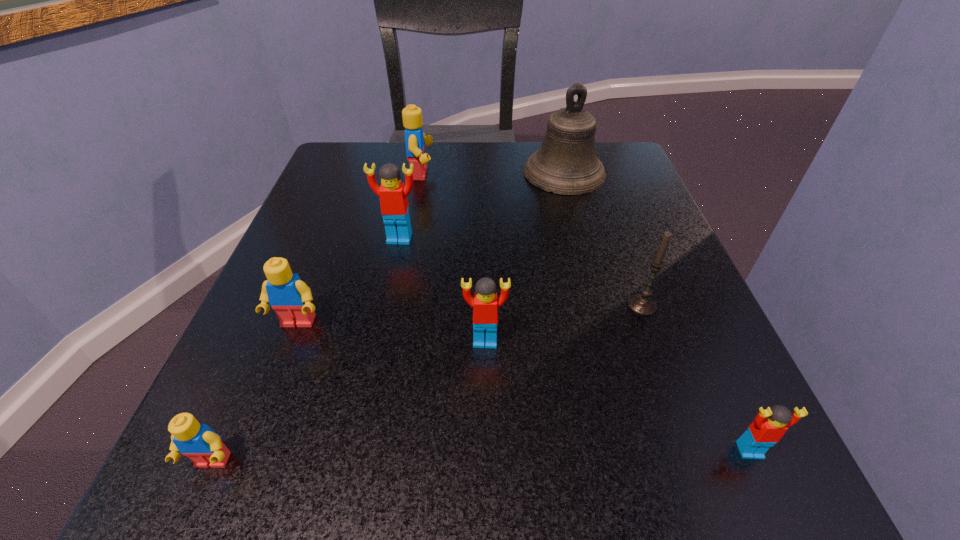
Find the location of a particular element. The image size is (960, 540). free space at the far left corner of the desktop is located at coordinates point(356,159).

The height and width of the screenshot is (540, 960). Identify the location of vacant space at the far right corner of the desktop. (619, 148).

Where is `free spot between the bell and the second nearest red Lego`? This screenshot has height=540, width=960. free spot between the bell and the second nearest red Lego is located at coordinates (524, 256).

Locate an element on the screen. This screenshot has height=540, width=960. unoccupied area between the candle and the farthest yellow Lego is located at coordinates (532, 239).

Where is `vacant area between the nearest red Lego and the smallest yellow Lego`? vacant area between the nearest red Lego and the smallest yellow Lego is located at coordinates (481, 456).

The width and height of the screenshot is (960, 540). I want to click on vacant point located between the second smallest red Lego and the nearest red Lego, so click(617, 395).

At what (x,y) coordinates should I click in order to perform the action: click on vacant area that lies between the second farthest red Lego and the fifth nearest Lego. Please return your answer as a coordinate pair (x, y). Looking at the image, I should click on click(443, 289).

Identify the location of free space between the candle and the second biggest yellow Lego. (469, 314).

Locate an element on the screen. The width and height of the screenshot is (960, 540). free spot between the tallest object and the nearest yellow Lego is located at coordinates (388, 318).

This screenshot has height=540, width=960. What are the coordinates of `free spot between the third farthest object and the candle` in the screenshot? It's located at (521, 272).